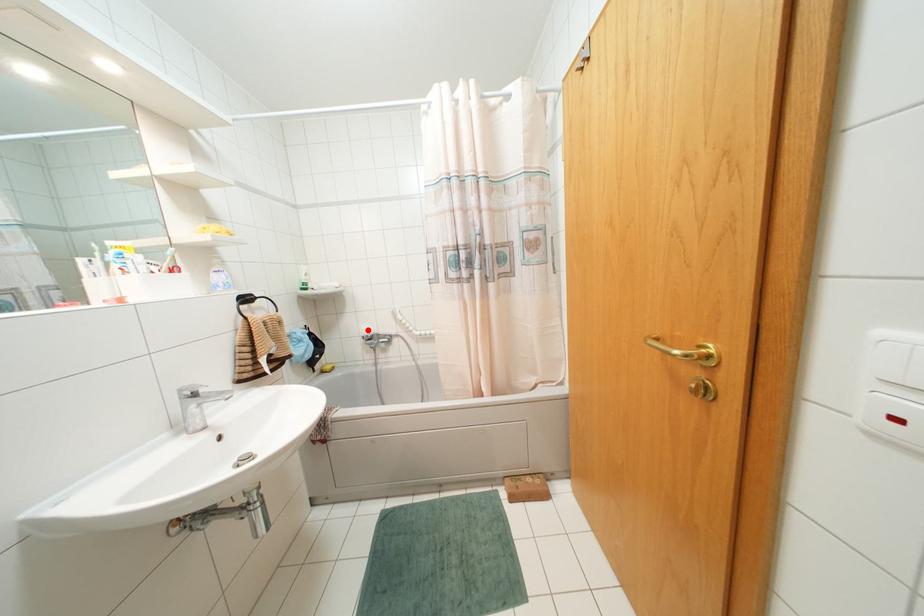
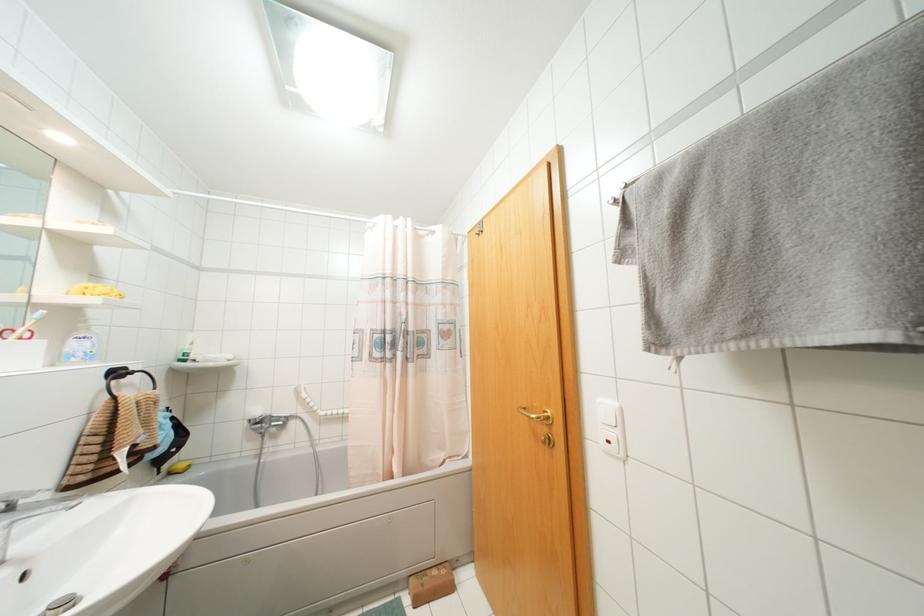
Question: I am providing you with two images of the same scene from different viewpoints. In image1, a red point is highlighted. Considering the same 3D point in image2, which of the following is correct?

Choices:
 (A) It is closer
 (B) It is farther

Answer: (B)